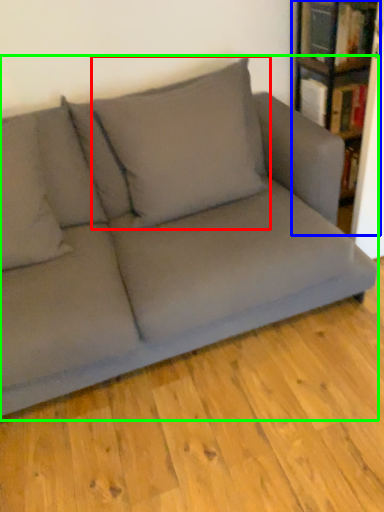
Question: Which is nearer to the pillow (highlighted by a red box)? bookcase (highlighted by a blue box) or studio couch (highlighted by a green box).

Choices:
 (A) bookcase
 (B) studio couch

Answer: (B)